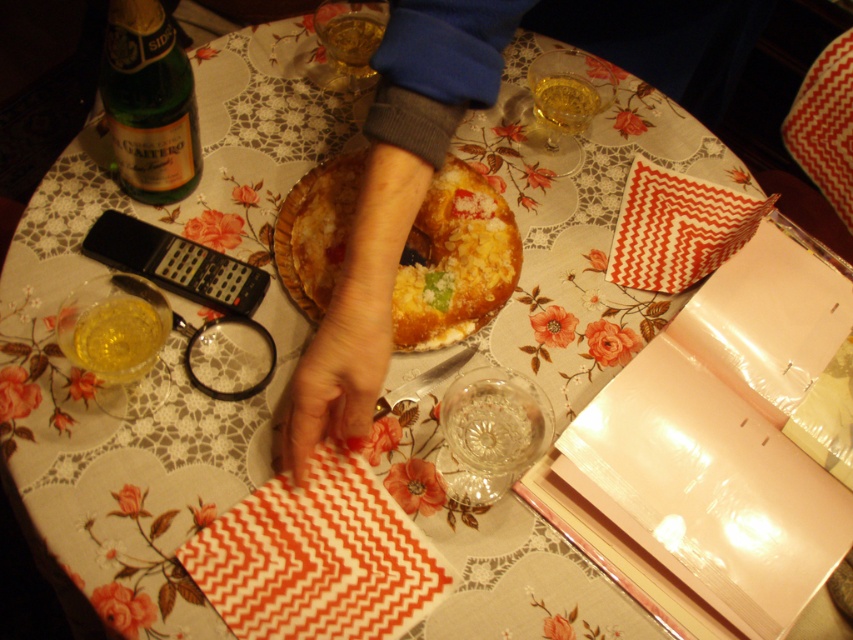
You are a server in a restaurant and need to place a dessert menu in between the smooth skin hand at center and the yellow cake at center. The dessert menu is 6 inches wide. Can you fit it between them?

The smooth skin hand at center and yellow cake at center are 5.88 inches apart from each other. Since the dessert menu is 6 inches wide, it cannot fit between them as the space is slightly narrower than the menu.